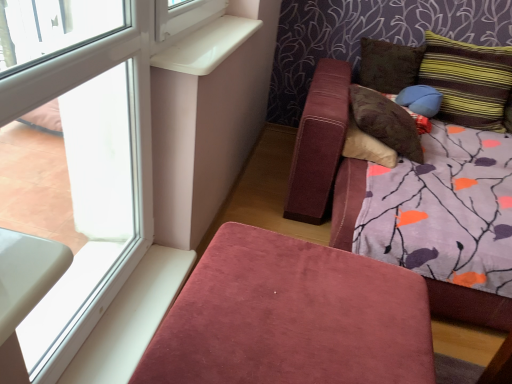
Where is `brown suede pillow at upper right, the 1th pillow positioned from the left`? Image resolution: width=512 pixels, height=384 pixels. brown suede pillow at upper right, the 1th pillow positioned from the left is located at coordinates (388, 122).

Measure the distance between point (376,65) and camera.

Point (376,65) is 2.55 meters from camera.

What do you see at coordinates (388, 65) in the screenshot? The image size is (512, 384). I see `brown suede pillow at upper right, which ranks as the third pillow in right-to-left order` at bounding box center [388, 65].

What do you see at coordinates (291, 317) in the screenshot?
I see `velvet pink ottoman at lower center` at bounding box center [291, 317].

At what (x,y) coordinates should I click in order to perform the action: click on white plastic window sill at upper left. Please return your answer as a coordinate pair (x, y). The width and height of the screenshot is (512, 384). Looking at the image, I should click on (207, 46).

Where is `blue fabric pillow at upper right, arranged as the second pillow when viewed from the right`? The width and height of the screenshot is (512, 384). blue fabric pillow at upper right, arranged as the second pillow when viewed from the right is located at coordinates (420, 100).

Find the location of a particular element. The height and width of the screenshot is (384, 512). transparent glass window at upper left is located at coordinates (99, 167).

Image resolution: width=512 pixels, height=384 pixels. What are the coordinates of `striped fabric pillow at upper right, which appears as the 1th pillow when viewed from the right` in the screenshot? It's located at (468, 81).

Between striped fabric pillow at upper right, which appears as the 1th pillow when viewed from the right, and velvet pink ottoman at lower center, which one has smaller size?

Smaller between the two is striped fabric pillow at upper right, which appears as the 1th pillow when viewed from the right.

Identify the location of the 3rd pillow above when counting from the velvet pink ottoman at lower center (from the image's perspective). (468, 81).

Do you think striped fabric pillow at upper right, which appears as the 1th pillow when viewed from the right, is within velvet pink ottoman at lower center, or outside of it?

striped fabric pillow at upper right, which appears as the 1th pillow when viewed from the right, is spatially situated outside velvet pink ottoman at lower center.

How many degrees apart are the facing directions of striped fabric pillow at upper right, which appears as the 1th pillow when viewed from the right, and velvet pink ottoman at lower center?

The angular difference between striped fabric pillow at upper right, which appears as the 1th pillow when viewed from the right, and velvet pink ottoman at lower center is 88 degrees.

Consider the image. Is blue fabric pillow at upper right, which ranks as the third pillow in left-to-right order, in contact with transparent glass window at upper left?

No, blue fabric pillow at upper right, which ranks as the third pillow in left-to-right order, is not next to transparent glass window at upper left.

Locate an element on the screen. Image resolution: width=512 pixels, height=384 pixels. the 1st pillow located beneath the transparent glass window at upper left (from a real-world perspective) is located at coordinates (420, 100).

Is transparent glass window at upper left a part of blue fabric pillow at upper right, arranged as the second pillow when viewed from the right?

That's incorrect, transparent glass window at upper left is not inside blue fabric pillow at upper right, arranged as the second pillow when viewed from the right.

From the picture: Is blue fabric pillow at upper right, arranged as the second pillow when viewed from the right, bigger or smaller than transparent glass window at upper left?

Clearly, blue fabric pillow at upper right, arranged as the second pillow when viewed from the right, is smaller in size than transparent glass window at upper left.

Is transparent glass window at upper left bigger than blue fabric pillow at upper right, which ranks as the third pillow in left-to-right order?

Yes.

Considering the positions of points (85, 128) and (428, 112), is point (85, 128) farther from camera compared to point (428, 112)?

No, it is not.

Does transparent glass window at upper left appear on the right side of blue fabric pillow at upper right, which ranks as the third pillow in left-to-right order?

No, transparent glass window at upper left is not to the right of blue fabric pillow at upper right, which ranks as the third pillow in left-to-right order.

This screenshot has width=512, height=384. Find the location of `window above the blue fabric pillow at upper right, arranged as the second pillow when viewed from the right (from a real-world perspective)`. window above the blue fabric pillow at upper right, arranged as the second pillow when viewed from the right (from a real-world perspective) is located at coordinates (99, 167).

Is white plastic window sill at upper left closer to the viewer compared to striped fabric pillow at upper right, which appears as the 1th pillow when viewed from the right?

That is True.

Which object is positioned more to the right, white plastic window sill at upper left or striped fabric pillow at upper right, which appears as the 1th pillow when viewed from the right?

striped fabric pillow at upper right, which appears as the 1th pillow when viewed from the right.

Is white plastic window sill at upper left aimed at striped fabric pillow at upper right, which appears as the 4th pillow when viewed from the left?

No, white plastic window sill at upper left is not facing towards striped fabric pillow at upper right, which appears as the 4th pillow when viewed from the left.

Considering the sizes of objects white plastic window sill at upper left and striped fabric pillow at upper right, which appears as the 1th pillow when viewed from the right, in the image provided, who is taller, white plastic window sill at upper left or striped fabric pillow at upper right, which appears as the 1th pillow when viewed from the right,?

With more height is striped fabric pillow at upper right, which appears as the 1th pillow when viewed from the right.

Considering the relative positions of transparent glass window at upper left and striped fabric pillow at upper right, which appears as the 4th pillow when viewed from the left, in the image provided, is transparent glass window at upper left to the right of striped fabric pillow at upper right, which appears as the 4th pillow when viewed from the left, from the viewer's perspective?

Incorrect, transparent glass window at upper left is not on the right side of striped fabric pillow at upper right, which appears as the 4th pillow when viewed from the left.

In terms of size, does transparent glass window at upper left appear bigger or smaller than striped fabric pillow at upper right, which appears as the 4th pillow when viewed from the left?

Considering their sizes, transparent glass window at upper left takes up less space than striped fabric pillow at upper right, which appears as the 4th pillow when viewed from the left.

Considering the sizes of objects transparent glass window at upper left and striped fabric pillow at upper right, which appears as the 4th pillow when viewed from the left, in the image provided, who is wider, transparent glass window at upper left or striped fabric pillow at upper right, which appears as the 4th pillow when viewed from the left,?

With larger width is striped fabric pillow at upper right, which appears as the 4th pillow when viewed from the left.

Is velvet pink ottoman at lower center oriented away from brown suede pillow at upper right, the fourth pillow when ordered from right to left?

No, velvet pink ottoman at lower center is not facing the opposite direction of brown suede pillow at upper right, the fourth pillow when ordered from right to left.

Are velvet pink ottoman at lower center and brown suede pillow at upper right, the 1th pillow positioned from the left, making contact?

No.

Considering the relative sizes of velvet pink ottoman at lower center and brown suede pillow at upper right, the fourth pillow when ordered from right to left, in the image provided, is velvet pink ottoman at lower center bigger than brown suede pillow at upper right, the fourth pillow when ordered from right to left,?

Indeed, velvet pink ottoman at lower center has a larger size compared to brown suede pillow at upper right, the fourth pillow when ordered from right to left.

From the image's perspective, between velvet pink ottoman at lower center and brown suede pillow at upper right, the 1th pillow positioned from the left, who is located below?

velvet pink ottoman at lower center is shown below in the image.

Are white plastic window sill at upper left and velvet pink ottoman at lower center beside each other?

No, white plastic window sill at upper left is not beside velvet pink ottoman at lower center.

From the image's perspective, is white plastic window sill at upper left above or below velvet pink ottoman at lower center?

white plastic window sill at upper left is situated higher than velvet pink ottoman at lower center in the image.

Considering the relative positions of white plastic window sill at upper left and velvet pink ottoman at lower center in the image provided, is white plastic window sill at upper left to the left or to the right of velvet pink ottoman at lower center?

white plastic window sill at upper left is positioned on velvet pink ottoman at lower center's left side.

In terms of height, does white plastic window sill at upper left look taller or shorter compared to velvet pink ottoman at lower center?

In the image, white plastic window sill at upper left appears to be shorter than velvet pink ottoman at lower center.

In the image, there is a striped fabric pillow at upper right, which appears as the 1th pillow when viewed from the right. Identify the location of furniture below it (from a real-world perspective). Image resolution: width=512 pixels, height=384 pixels. (291, 317).

Locate an element on the screen. The width and height of the screenshot is (512, 384). window that is below the blue fabric pillow at upper right, which ranks as the third pillow in left-to-right order (from the image's perspective) is located at coordinates (99, 167).

Looking at the image, which one is located closer to white plastic window sill at upper left, striped fabric pillow at upper right, which appears as the 1th pillow when viewed from the right, or brown suede pillow at upper right, the fourth pillow when ordered from right to left?

brown suede pillow at upper right, the fourth pillow when ordered from right to left.

From the image, which object appears to be nearer to transparent glass window at upper left, velvet pink ottoman at lower center or blue fabric pillow at upper right, which ranks as the third pillow in left-to-right order?

The object closer to transparent glass window at upper left is velvet pink ottoman at lower center.

From the picture: From the image, which object appears to be farther from white plastic window sill at upper left, brown suede pillow at upper right, the fourth pillow when ordered from right to left, or striped fabric pillow at upper right, which appears as the 4th pillow when viewed from the left?

striped fabric pillow at upper right, which appears as the 4th pillow when viewed from the left.

Looking at the image, which one is located further to blue fabric pillow at upper right, which ranks as the third pillow in left-to-right order, brown suede pillow at upper right, which appears as the second pillow when viewed from the left, or striped fabric pillow at upper right, which appears as the 4th pillow when viewed from the left?

Among the two, brown suede pillow at upper right, which appears as the second pillow when viewed from the left, is located further to blue fabric pillow at upper right, which ranks as the third pillow in left-to-right order.

Estimate the real-world distances between objects in this image. Which object is further from brown suede pillow at upper right, which appears as the second pillow when viewed from the left, striped fabric pillow at upper right, which appears as the 4th pillow when viewed from the left, or blue fabric pillow at upper right, which ranks as the third pillow in left-to-right order?

Among the two, striped fabric pillow at upper right, which appears as the 4th pillow when viewed from the left, is located further to brown suede pillow at upper right, which appears as the second pillow when viewed from the left.

When comparing their distances from brown suede pillow at upper right, which appears as the second pillow when viewed from the left, does brown suede pillow at upper right, the fourth pillow when ordered from right to left, or transparent glass window at upper left seem closer?

Among the two, brown suede pillow at upper right, the fourth pillow when ordered from right to left, is located nearer to brown suede pillow at upper right, which appears as the second pillow when viewed from the left.

Which object lies nearer to the anchor point transparent glass window at upper left, brown suede pillow at upper right, the fourth pillow when ordered from right to left, or striped fabric pillow at upper right, which appears as the 1th pillow when viewed from the right?

brown suede pillow at upper right, the fourth pillow when ordered from right to left.

Based on their spatial positions, is velvet pink ottoman at lower center or white plastic window sill at upper left closer to striped fabric pillow at upper right, which appears as the 4th pillow when viewed from the left?

The object closer to striped fabric pillow at upper right, which appears as the 4th pillow when viewed from the left, is white plastic window sill at upper left.

At what (x,y) coordinates should I click in order to perform the action: click on furniture between transparent glass window at upper left and brown suede pillow at upper right, the 1th pillow positioned from the left, in the front-back direction. Please return your answer as a coordinate pair (x, y). The width and height of the screenshot is (512, 384). Looking at the image, I should click on (291, 317).

Where is `window sill between velvet pink ottoman at lower center and blue fabric pillow at upper right, arranged as the second pillow when viewed from the right, in the front-back direction`? The width and height of the screenshot is (512, 384). window sill between velvet pink ottoman at lower center and blue fabric pillow at upper right, arranged as the second pillow when viewed from the right, in the front-back direction is located at coordinates (207, 46).

I want to click on window between white plastic window sill at upper left and velvet pink ottoman at lower center in the up-down direction, so click(99, 167).

The height and width of the screenshot is (384, 512). In order to click on pillow positioned between velvet pink ottoman at lower center and brown suede pillow at upper right, the fourth pillow when ordered from right to left, from near to far in this screenshot , I will do `click(468, 81)`.